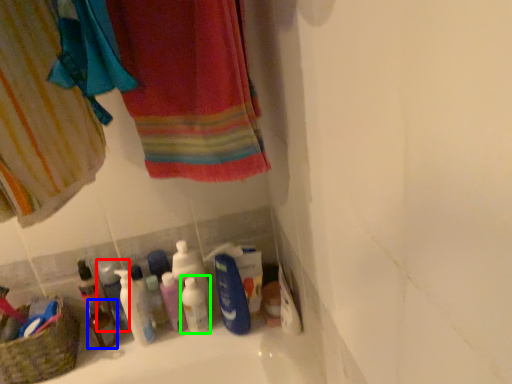
Question: Based on their relative distances, which object is farther from mouthwash (highlighted by a red box)? Choose from mouthwash (highlighted by a blue box) and mouthwash (highlighted by a green box).

Choices:
 (A) mouthwash
 (B) mouthwash

Answer: (B)